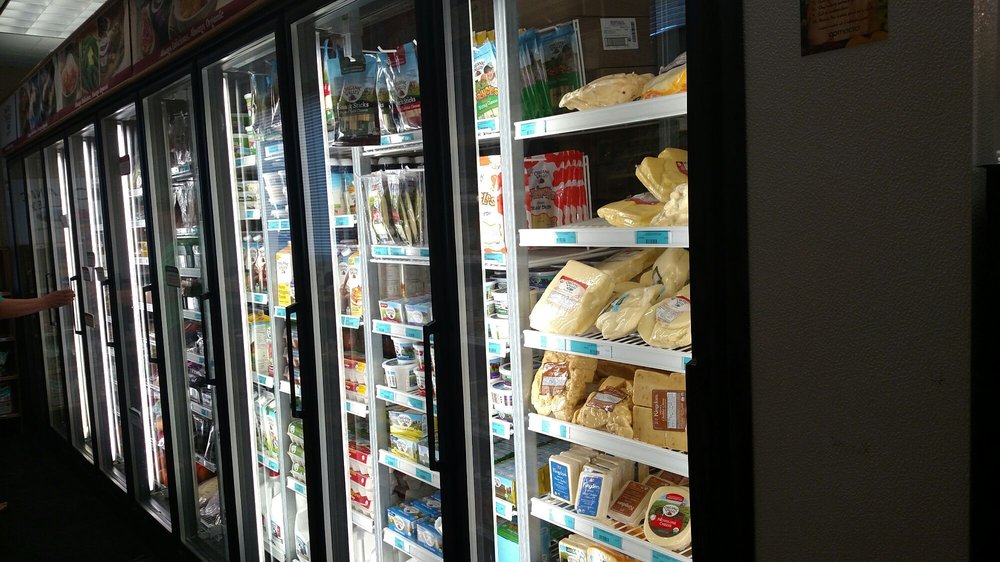
This screenshot has height=562, width=1000. Find the location of `first fridge dooron the right`. first fridge dooron the right is located at coordinates (594, 391).